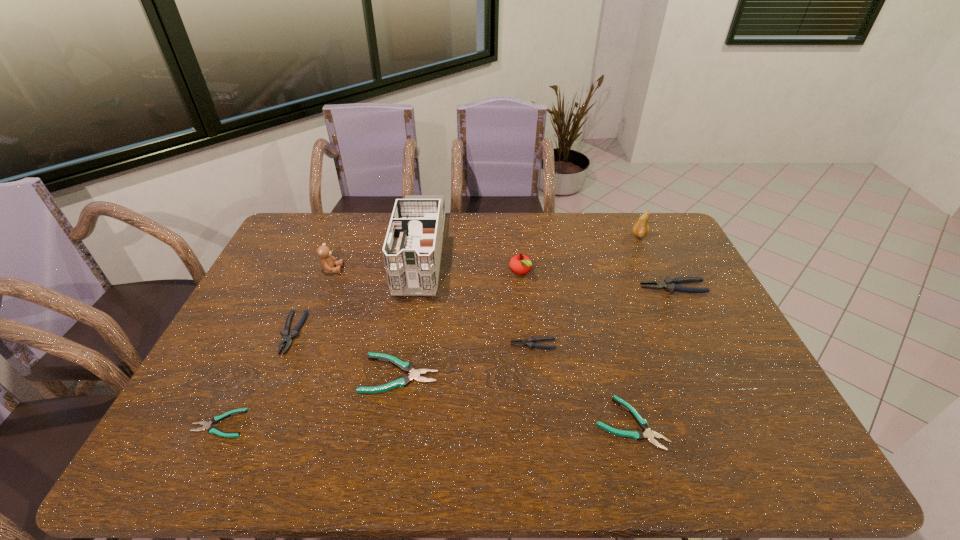
The width and height of the screenshot is (960, 540). What are the coordinates of `vacant space at the right edge` in the screenshot? It's located at (711, 335).

What are the coordinates of `free location at the near left corner` in the screenshot? It's located at (227, 443).

Where is `vacant space at the far right corner of the desktop`? The height and width of the screenshot is (540, 960). vacant space at the far right corner of the desktop is located at coordinates (662, 219).

Where is `free space between the shortest pliers and the pear`? The image size is (960, 540). free space between the shortest pliers and the pear is located at coordinates (429, 330).

What are the coordinates of `free space between the seventh shortest object and the pear` in the screenshot? It's located at (580, 254).

The image size is (960, 540). Identify the location of free space between the second biggest gray pliers and the apple. (406, 302).

Image resolution: width=960 pixels, height=540 pixels. In order to click on free space between the second teal pliers from left to right and the second gray pliers from left to right in this screenshot , I will do `click(467, 359)`.

Identify the location of free spot between the pear and the farthest pliers. pos(656,262).

Image resolution: width=960 pixels, height=540 pixels. Identify the location of empty space between the fifth shortest object and the leftmost teal pliers. (256, 379).

Image resolution: width=960 pixels, height=540 pixels. In order to click on vacant area that lies between the second teal pliers from left to right and the fourth tallest object in this screenshot , I will do `click(460, 323)`.